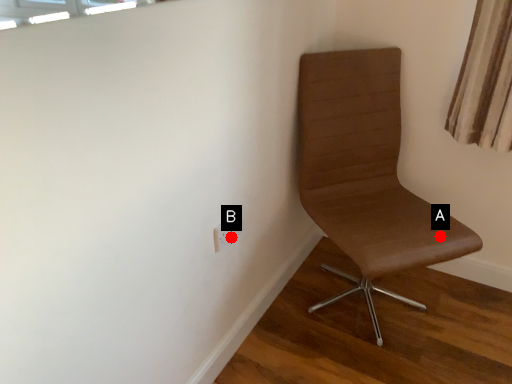
Question: Two points are circled on the image, labeled by A and B beside each circle. Which point appears farthest from the camera in this image?

Choices:
 (A) A is further
 (B) B is further

Answer: (B)